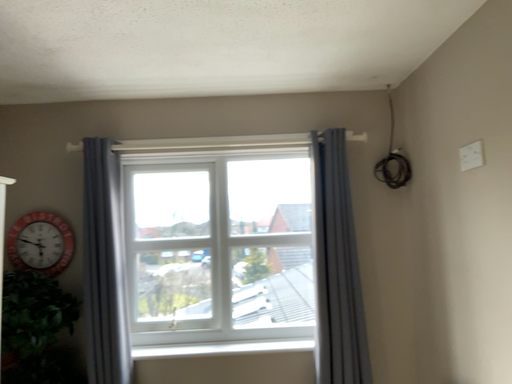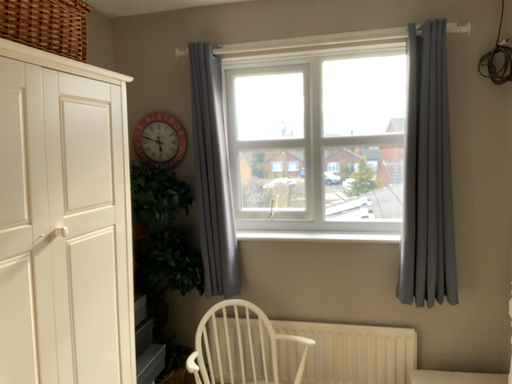
Question: How did the camera likely rotate when shooting the video?

Choices:
 (A) rotated left
 (B) rotated right

Answer: (A)